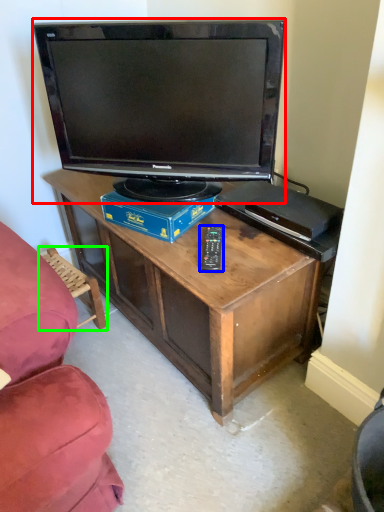
Question: Which object is the farthest from television (highlighted by a red box)? Choose among these: remote (highlighted by a blue box) or swivel chair (highlighted by a green box).

Choices:
 (A) remote
 (B) swivel chair

Answer: (B)